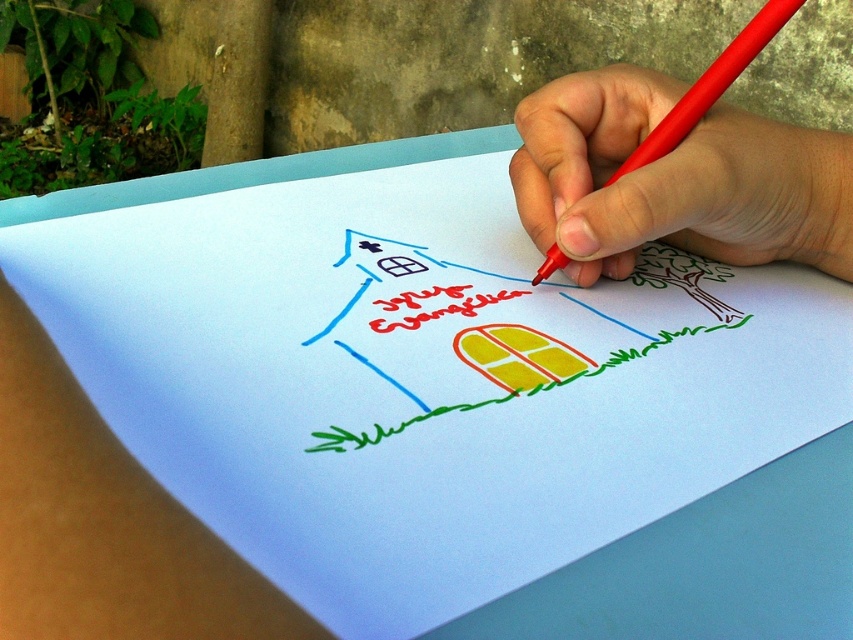
Question: Can you confirm if smooth red pen at upper right is positioned to the left of white paper at center?

Choices:
 (A) no
 (B) yes

Answer: (A)

Question: Is smooth red pen at upper right to the right of white paper at center from the viewer's perspective?

Choices:
 (A) yes
 (B) no

Answer: (A)

Question: Which object appears farthest from the camera in this image?

Choices:
 (A) smooth red pen at upper right
 (B) white paper at center

Answer: (A)

Question: Is smooth red pen at upper right wider than white paper at center?

Choices:
 (A) yes
 (B) no

Answer: (A)

Question: Among these objects, which one is farthest from the camera?

Choices:
 (A) smooth red pen at upper right
 (B) white paper at center

Answer: (A)

Question: Which point is closer to the camera?

Choices:
 (A) white paper at center
 (B) smooth red pen at upper right

Answer: (A)